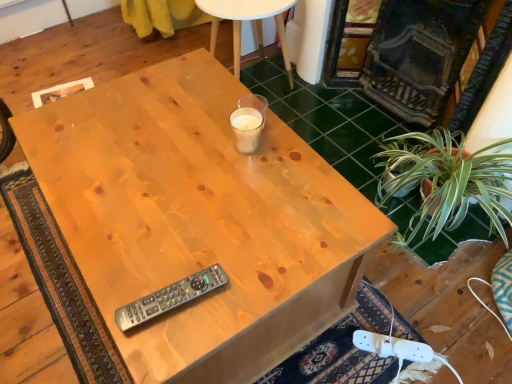
Where is `free spot to the right of translucent glass candle at center, the 2th coffee cup when ordered from top to bottom`? The width and height of the screenshot is (512, 384). free spot to the right of translucent glass candle at center, the 2th coffee cup when ordered from top to bottom is located at coordinates (288, 152).